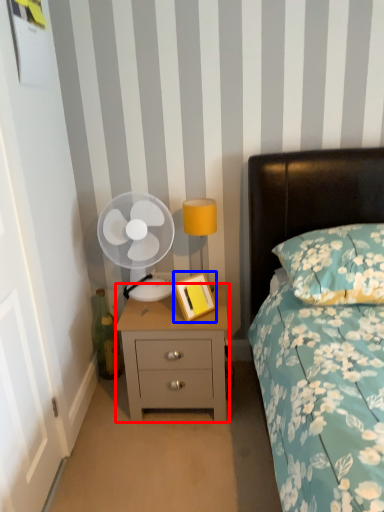
Question: Which point is closer to the camera, nightstand (highlighted by a red box) or picture frame (highlighted by a blue box)?

Choices:
 (A) nightstand
 (B) picture frame

Answer: (B)